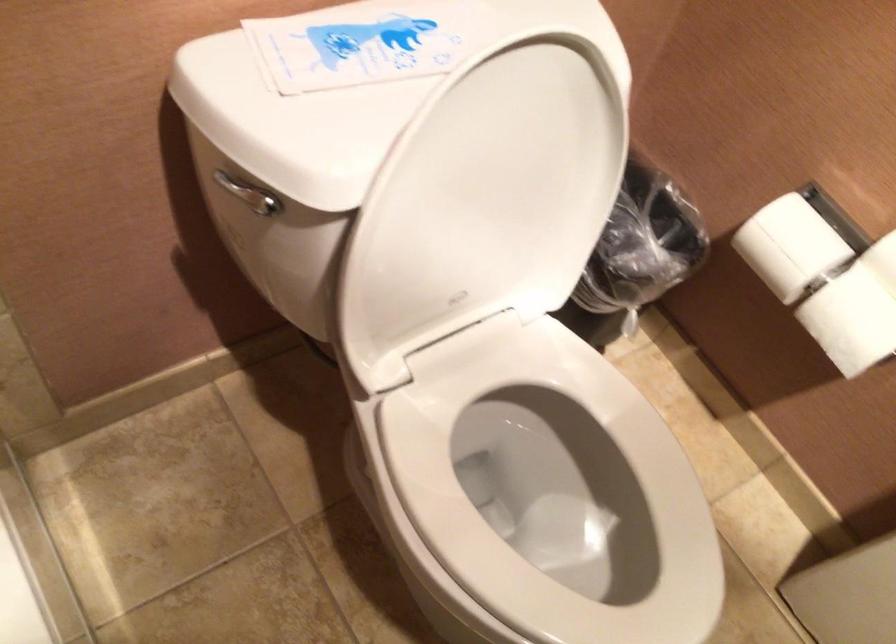
Locate an element on the screen. white toilet lid is located at coordinates (484, 204).